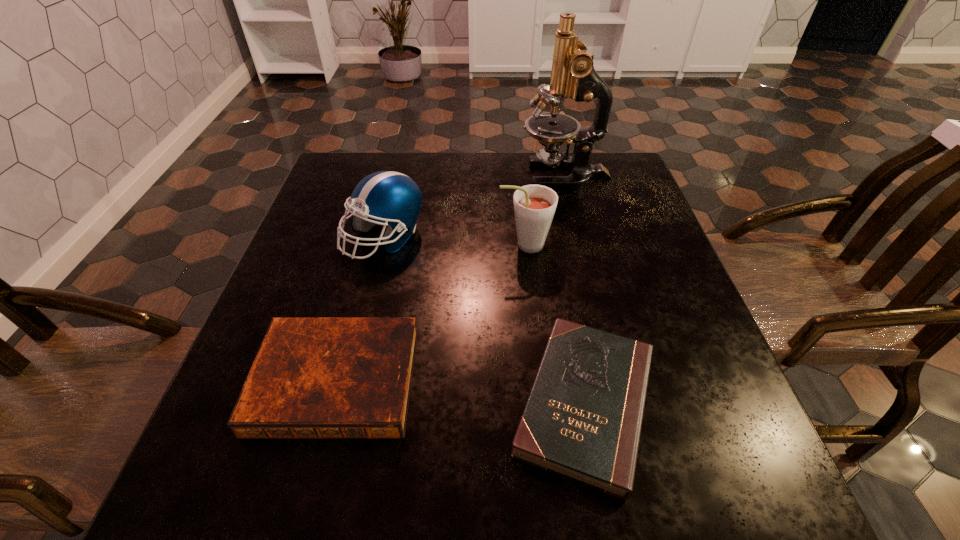
Where is `vacant space located 0.090m on the drink side of the root beer`? Image resolution: width=960 pixels, height=540 pixels. vacant space located 0.090m on the drink side of the root beer is located at coordinates (459, 245).

You are a GUI agent. You are given a task and a screenshot of the screen. Output one action in this format:
    pyautogui.click(x=<x>, y=<y>)
    Task: Click on the blank space located 0.160m on the drink side of the root beer
    The image size is (960, 540).
    Given the screenshot: What is the action you would take?
    pyautogui.click(x=429, y=245)

What are the coordinates of `vacant space located 0.320m at the front of the football helmet with the faceguard` in the screenshot? It's located at (346, 397).

You are a GUI agent. You are given a task and a screenshot of the screen. Output one action in this format:
    pyautogui.click(x=<x>, y=<y>)
    Task: Click on the vacant space located 0.080m on the spine side of the left Bible
    The width and height of the screenshot is (960, 540).
    Given the screenshot: What is the action you would take?
    pyautogui.click(x=306, y=492)

In order to click on vacant space positioned 0.110m on the right of the right Bible in this screenshot , I will do `click(729, 403)`.

At what (x,y) coordinates should I click in order to perform the action: click on object that is at the far edge. Please return your answer as a coordinate pair (x, y). The width and height of the screenshot is (960, 540). Looking at the image, I should click on (573, 75).

Find the location of a particular element. The width and height of the screenshot is (960, 540). object that is at the near edge is located at coordinates (582, 420).

At what (x,y) coordinates should I click in order to perform the action: click on football helmet at the left edge. Please return your answer as a coordinate pair (x, y). This screenshot has height=540, width=960. Looking at the image, I should click on (393, 198).

Locate an element on the screen. Bible present at the left edge is located at coordinates (312, 377).

Identify the location of microscope that is at the right edge. (573, 75).